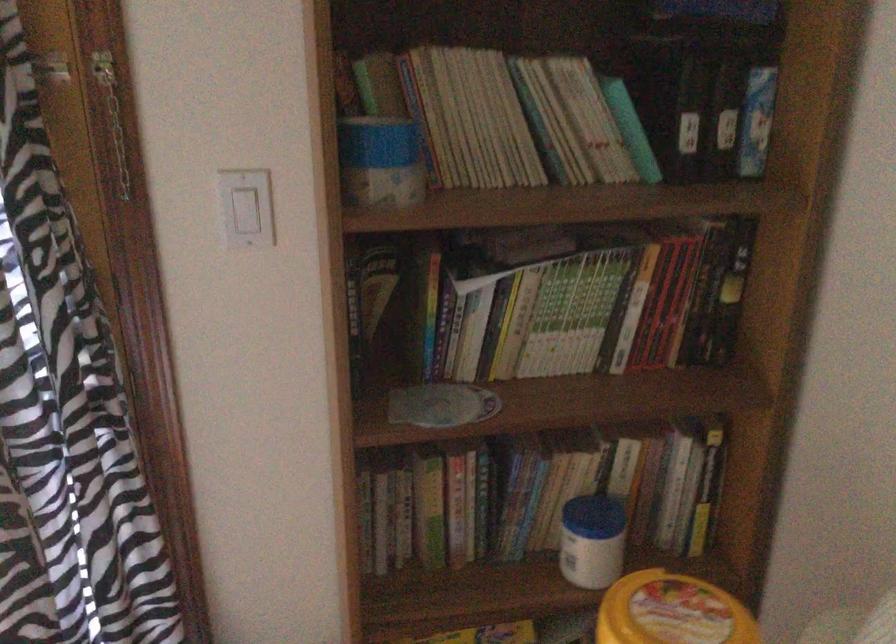
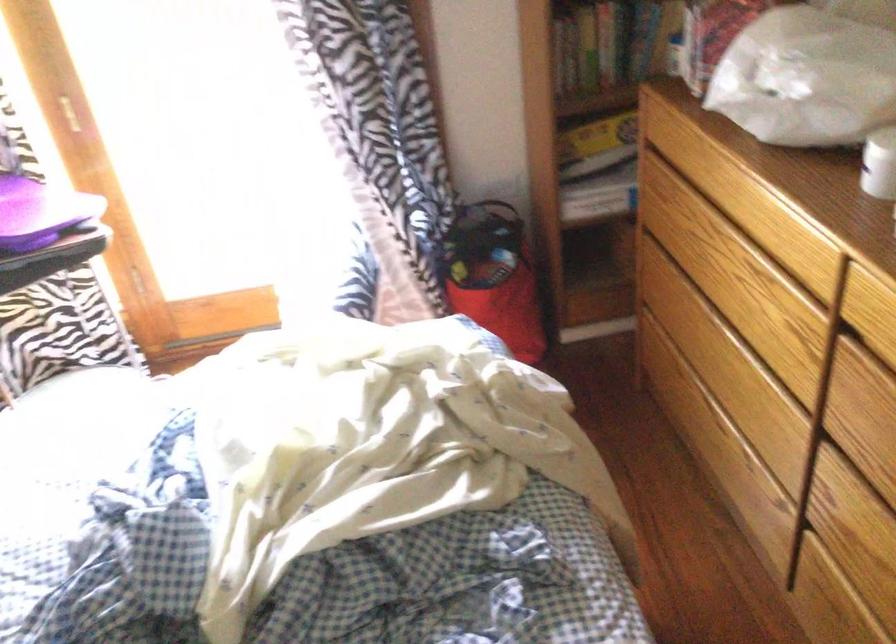
The point at [459,529] is marked in the first image. Where is the corresponding point in the second image?

(606, 44)